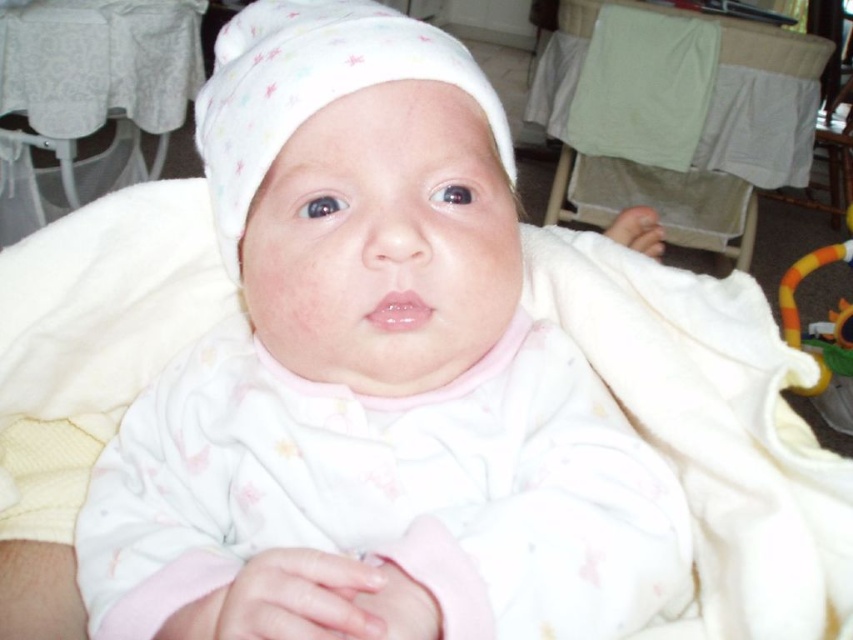
Who is taller, white soft baby at center or white soft hat at center?

white soft baby at center is taller.

Can you confirm if white soft baby at center is positioned below white soft hat at center?

Yes.

Describe the element at coordinates (372, 380) in the screenshot. I see `white soft baby at center` at that location.

This screenshot has height=640, width=853. In order to click on white soft baby at center in this screenshot , I will do `click(372, 380)`.